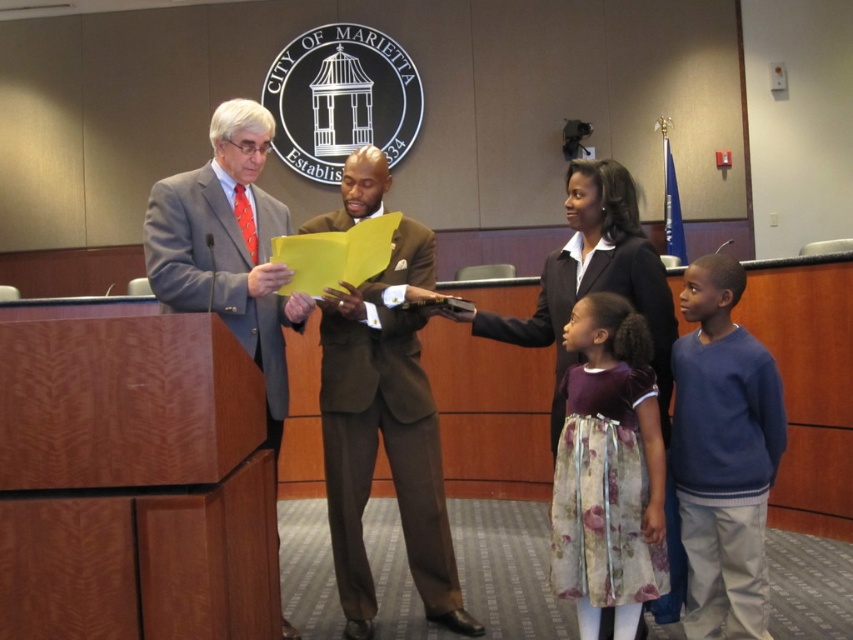
In the scene shown: You are attending a city council meeting in the City of Marietta. You notice two individuals at the center of the scene wearing a floral silk dress at center and a matte black suit at center. Based on their positions, which one is closer to you?

The floral silk dress at center is closer to you because it is in front of the matte black suit at center.

You are a photographer at a City of Marietta event and need to adjust the camera focus. The blue sweater at right and the matte gray suit at left are both in the frame. Which one should you focus on first if you want to capture the tallest object in the scene?

The matte gray suit at left is taller than the blue sweater at right, so you should focus on the matte gray suit at left first to capture the tallest object in the scene.